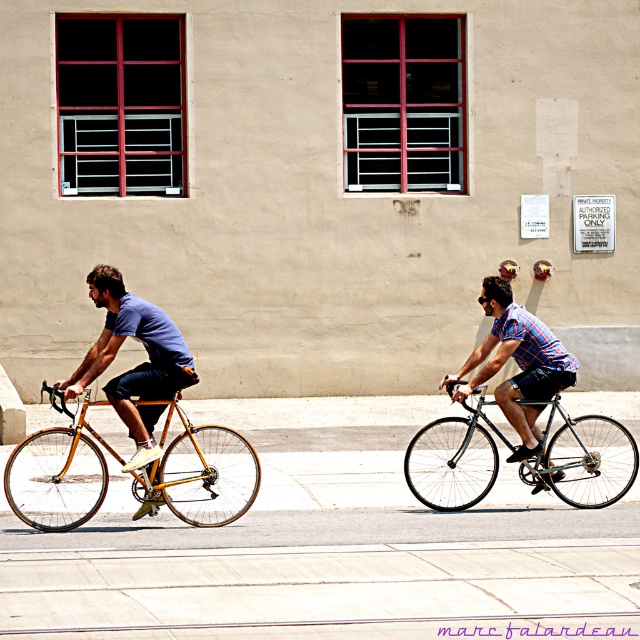
You are a delivery person who needs to park your bicycle in the authorized area. The authorized parking zone is marked by a point at coordinates (58, 472). Which bicycle should you park closest to this point?

The gold metallic bicycle at left is located at point (58, 472), so you should park closest to the gold metallic bicycle at left.

You are a delivery person who needs to park your bicycle between two bicycles in the scene. The gold metallic bicycle at left and the matte gold bicycle at left are both present. Which bicycle should you park next to if you want to maximize the space between your bicycle and the existing ones?

You should park next to the matte gold bicycle at left because its width is smaller than the gold metallic bicycle at left, allowing more space between your bicycle and the existing ones.

You are a delivery person who needs to park your bicycle near the beige building with the Authorized Parking Only sign. The shiny silver bicycle at right and the matte gold bicycle at left are already parked there. According to the sign, only bicycles with a metallic finish are allowed. Which bicycle is allowed to stay?

The shiny silver bicycle at right has a metallic finish and is allowed to stay, while the matte gold bicycle at left does not qualify as metallic under the sign.